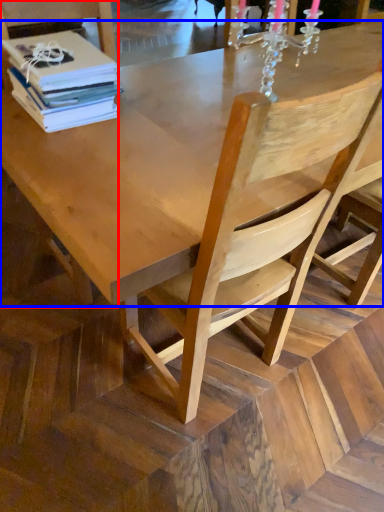
Question: Among these objects, which one is farthest to the camera, chair (highlighted by a red box) or round table (highlighted by a blue box)?

Choices:
 (A) chair
 (B) round table

Answer: (A)